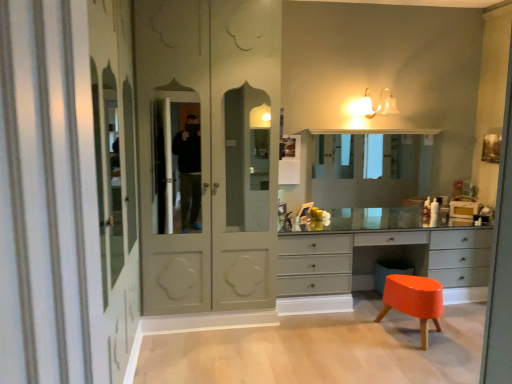
You are a GUI agent. You are given a task and a screenshot of the screen. Output one action in this format:
    pyautogui.click(x=<x>, y=<y>)
    Task: Click on the vacant region above clear glass medicine cabinet at center (from a real-world perspective)
    This screenshot has width=512, height=384.
    Given the screenshot: What is the action you would take?
    coord(368,131)